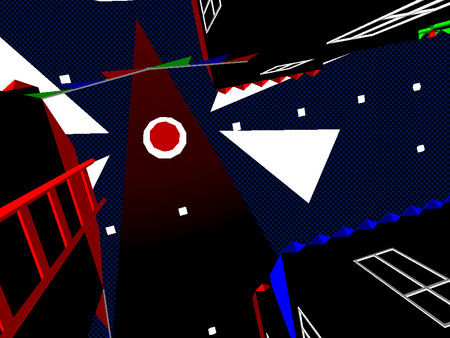
You are a GUI agent. You are given a task and a screenshot of the screen. Output one action in this format:
    pyautogui.click(x=<x>, y=<y>)
    Task: Click on the light blue trim
    
    Given the screenshot: What is the action you would take?
    pyautogui.click(x=279, y=287), pyautogui.click(x=343, y=235)